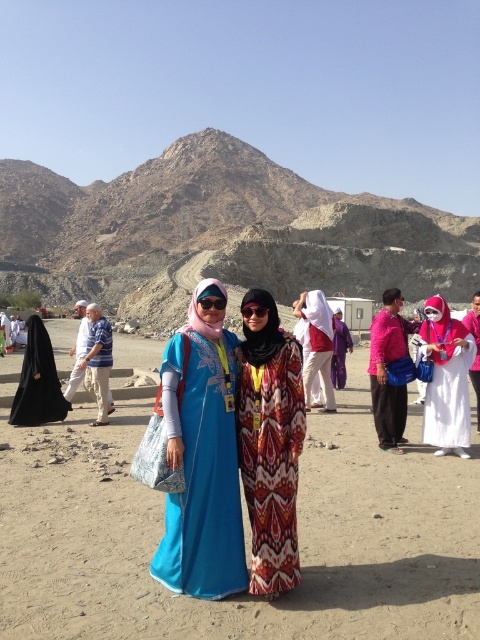
Is white satin dress at center bigger than matte white dress at center?

Actually, white satin dress at center might be smaller than matte white dress at center.

Does point (466, 445) come in front of point (324, 320)?

Yes, point (466, 445) is closer to viewer.

This screenshot has width=480, height=640. I want to click on white satin dress at center, so click(x=445, y=380).

Is point (188, 465) positioned after point (388, 332)?

No, it is in front of (388, 332).

Does point (170, 570) come in front of point (395, 324)?

Yes, it is.

Locate an element on the screen. The height and width of the screenshot is (640, 480). blue satin dress at center is located at coordinates (202, 454).

Can you confirm if dirt field at center is positioned above printed fabric dress at center?

Incorrect, dirt field at center is not positioned above printed fabric dress at center.

Can you confirm if dirt field at center is positioned below printed fabric dress at center?

Correct, dirt field at center is located below printed fabric dress at center.

Who is more forward, [72,516] or [282,577]?

Point [282,577]

Identify the location of dirt field at center. (298, 531).